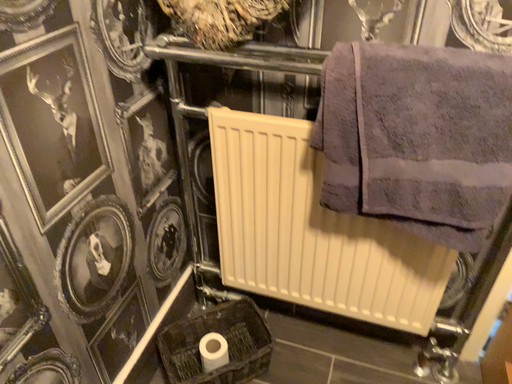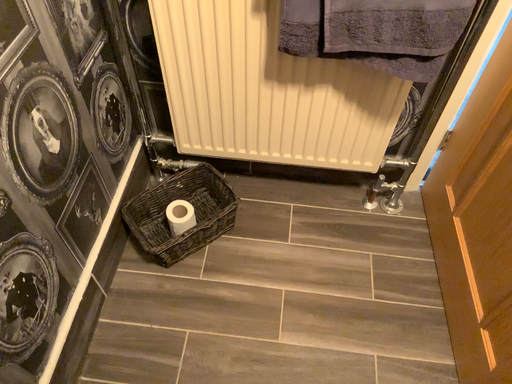
Question: How did the camera likely rotate when shooting the video?

Choices:
 (A) rotated right
 (B) rotated left

Answer: (A)